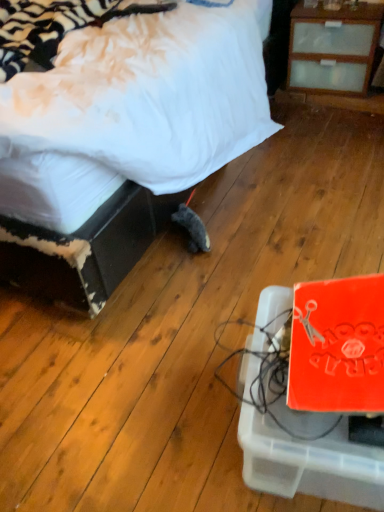
The image size is (384, 512). Describe the element at coordinates (134, 165) in the screenshot. I see `white soft bed at center` at that location.

In order to face white soft bed at center, should I rotate leftwards or rightwards?

You should rotate left by 19.554 degrees.

Locate an element on the screen. white soft bed at center is located at coordinates (134, 165).

Where is `orange matte cardboard box at lower right`? The width and height of the screenshot is (384, 512). orange matte cardboard box at lower right is located at coordinates (299, 432).

In order to face orange matte cardboard box at lower right, should I rotate leftwards or rightwards?

Turn right approximately 16.633 degrees to face it.

What do you see at coordinates (299, 432) in the screenshot? Image resolution: width=384 pixels, height=512 pixels. I see `orange matte cardboard box at lower right` at bounding box center [299, 432].

I want to click on white soft bed at center, so click(x=134, y=165).

Does orange matte cardboard box at lower right appear on the left side of white soft bed at center?

No.

Relative to white soft bed at center, is orange matte cardboard box at lower right in front or behind?

orange matte cardboard box at lower right is in front of white soft bed at center.

Between point (339, 459) and point (252, 96), which one is positioned behind?

The point (252, 96) is farther from the camera.

From the image's perspective, is orange matte cardboard box at lower right positioned above or below white soft bed at center?

orange matte cardboard box at lower right is situated lower than white soft bed at center in the image.

From a real-world perspective, is orange matte cardboard box at lower right physically located above or below white soft bed at center?

orange matte cardboard box at lower right is situated lower than white soft bed at center in the real world.

Looking at their sizes, would you say orange matte cardboard box at lower right is wider or thinner than white soft bed at center?

Considering their sizes, orange matte cardboard box at lower right looks slimmer than white soft bed at center.

Considering the sizes of objects orange matte cardboard box at lower right and white soft bed at center in the image provided, who is taller, orange matte cardboard box at lower right or white soft bed at center?

white soft bed at center.

Can you confirm if orange matte cardboard box at lower right is bigger than white soft bed at center?

No.

Is orange matte cardboard box at lower right situated inside white soft bed at center or outside?

orange matte cardboard box at lower right is not enclosed by white soft bed at center.

Is orange matte cardboard box at lower right next to white soft bed at center and touching it?

No, orange matte cardboard box at lower right is not next to white soft bed at center.

Is orange matte cardboard box at lower right positioned with its back to white soft bed at center?

orange matte cardboard box at lower right does not have its back to white soft bed at center.

How many degrees apart are the facing directions of orange matte cardboard box at lower right and white soft bed at center?

They differ by 76.3 degrees in their facing directions.

You are a GUI agent. You are given a task and a screenshot of the screen. Output one action in this format:
    pyautogui.click(x=<x>, y=<y>)
    Task: Click on the bed on the left side of orange matte cardboard box at lower right
    Image resolution: width=384 pixels, height=512 pixels.
    Given the screenshot: What is the action you would take?
    pyautogui.click(x=134, y=165)

In the scene shown: Which is more to the left, white soft bed at center or orange matte cardboard box at lower right?

Positioned to the left is white soft bed at center.

In the image, is white soft bed at center positioned in front of or behind orange matte cardboard box at lower right?

Visually, white soft bed at center is located behind orange matte cardboard box at lower right.

Between point (241, 44) and point (345, 441), which one is positioned in front?

Point (345, 441)

From the image's perspective, is white soft bed at center located above or below orange matte cardboard box at lower right?

white soft bed at center is situated higher than orange matte cardboard box at lower right in the image.

From a real-world perspective, is white soft bed at center on top of orange matte cardboard box at lower right?

Yes, from a real-world perspective, white soft bed at center is on top of orange matte cardboard box at lower right.

Based on the photo, considering the sizes of white soft bed at center and orange matte cardboard box at lower right in the image, is white soft bed at center wider or thinner than orange matte cardboard box at lower right?

In the image, white soft bed at center appears to be wider than orange matte cardboard box at lower right.

Can you confirm if white soft bed at center is shorter than orange matte cardboard box at lower right?

No.

Consider the image. Can you confirm if white soft bed at center is smaller than orange matte cardboard box at lower right?

Incorrect, white soft bed at center is not smaller in size than orange matte cardboard box at lower right.

Could orange matte cardboard box at lower right be considered to be inside white soft bed at center?

No, orange matte cardboard box at lower right is not surrounded by white soft bed at center.

Is white soft bed at center placed right next to orange matte cardboard box at lower right?

No.

From the picture: Is white soft bed at center turned away from orange matte cardboard box at lower right?

No, white soft bed at center is not facing away from orange matte cardboard box at lower right.

Can you tell me how much white soft bed at center and orange matte cardboard box at lower right differ in facing direction?

76.3 degrees.

I want to click on bed positioned vertically above the orange matte cardboard box at lower right (from a real-world perspective), so click(134, 165).

The height and width of the screenshot is (512, 384). What are the coordinates of `cardboard box that is on the right side of white soft bed at center` in the screenshot? It's located at (299, 432).

The width and height of the screenshot is (384, 512). I want to click on cardboard box located below the white soft bed at center (from the image's perspective), so click(299, 432).